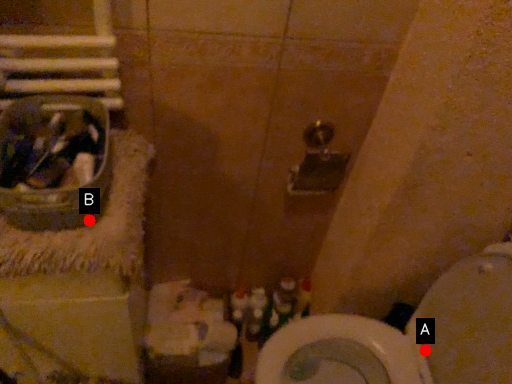
Question: Two points are circled on the image, labeled by A and B beside each circle. Which point is further to the camera?

Choices:
 (A) A is further
 (B) B is further

Answer: (A)